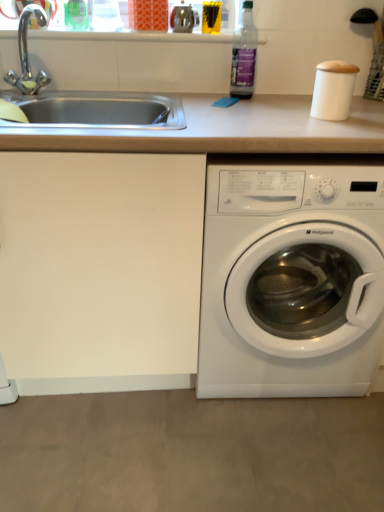
Question: Considering the positions of point (26, 59) and point (54, 344), is point (26, 59) closer or farther from the camera than point (54, 344)?

Choices:
 (A) closer
 (B) farther

Answer: (B)

Question: Based on their sizes in the image, would you say chrome metallic faucet at upper left is bigger or smaller than white matte counter top at center?

Choices:
 (A) big
 (B) small

Answer: (B)

Question: Which object is the closest to the chrome metallic faucet at upper left?

Choices:
 (A) white plastic washing machine at lower right
 (B) transparent plastic bottle at upper right
 (C) white matte counter top at center

Answer: (B)

Question: Considering the real-world distances, which object is farthest from the chrome metallic faucet at upper left?

Choices:
 (A) white plastic washing machine at lower right
 (B) white matte counter top at center
 (C) transparent plastic bottle at upper right

Answer: (A)